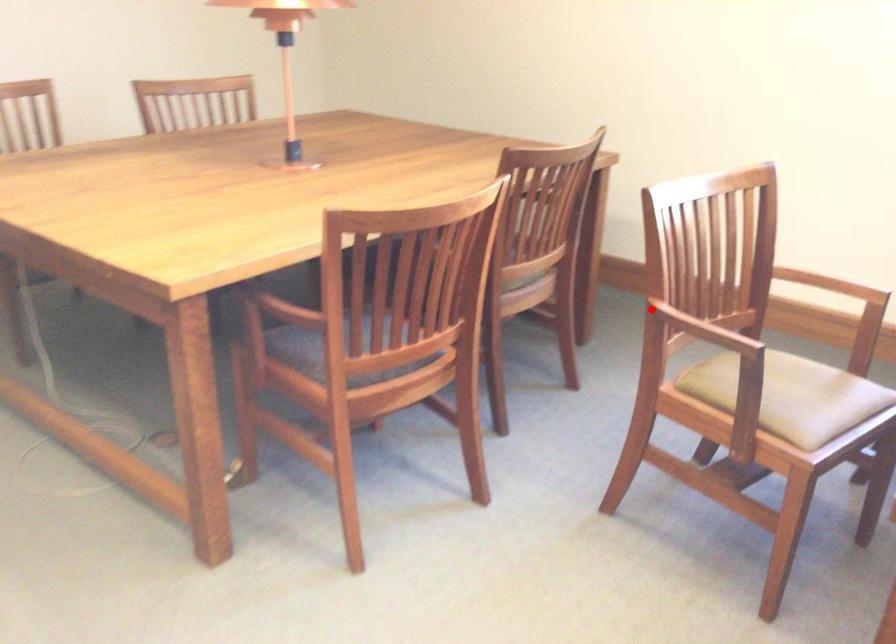
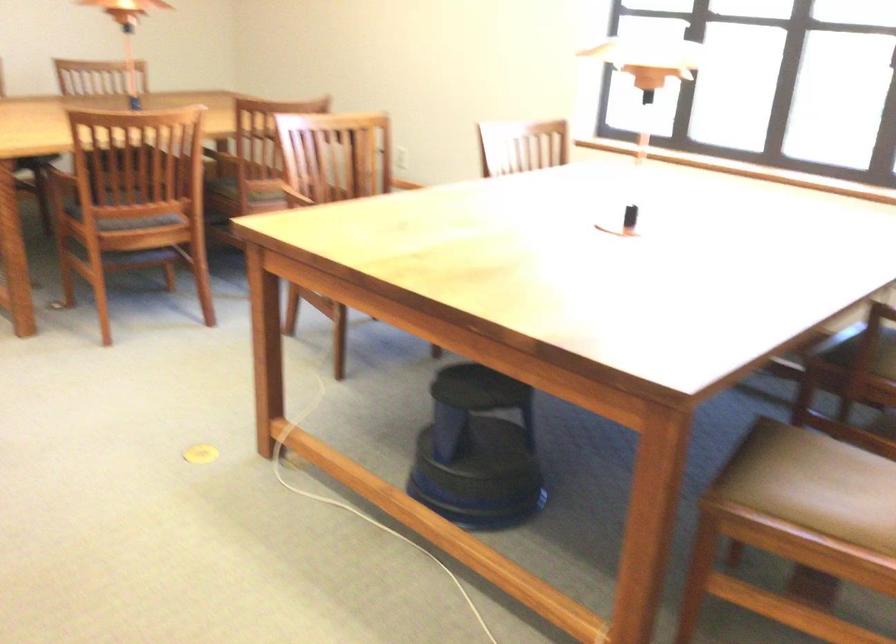
Question: I am providing you with two images of the same scene from different viewpoints. A red point is shown in image1. For the corresponding object point in image2, is it positioned nearer or farther from the camera?

Choices:
 (A) Nearer
 (B) Farther

Answer: (B)